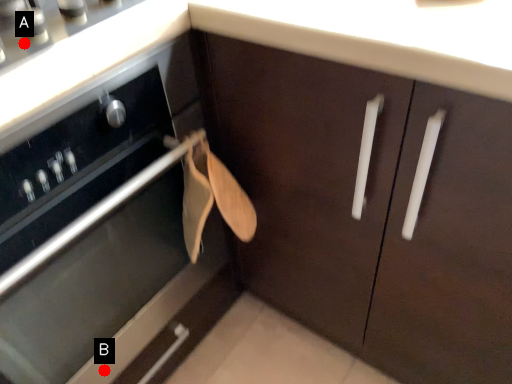
Question: Two points are circled on the image, labeled by A and B beside each circle. Which point appears farthest from the camera in this image?

Choices:
 (A) A is further
 (B) B is further

Answer: (B)